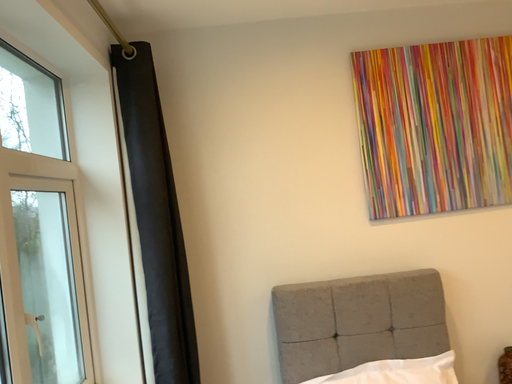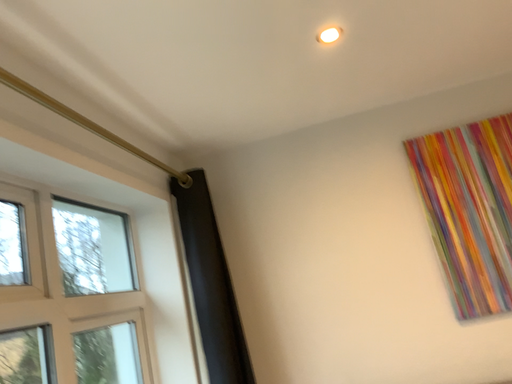
Question: How did the camera likely rotate when shooting the video?

Choices:
 (A) rotated downward
 (B) rotated upward

Answer: (B)